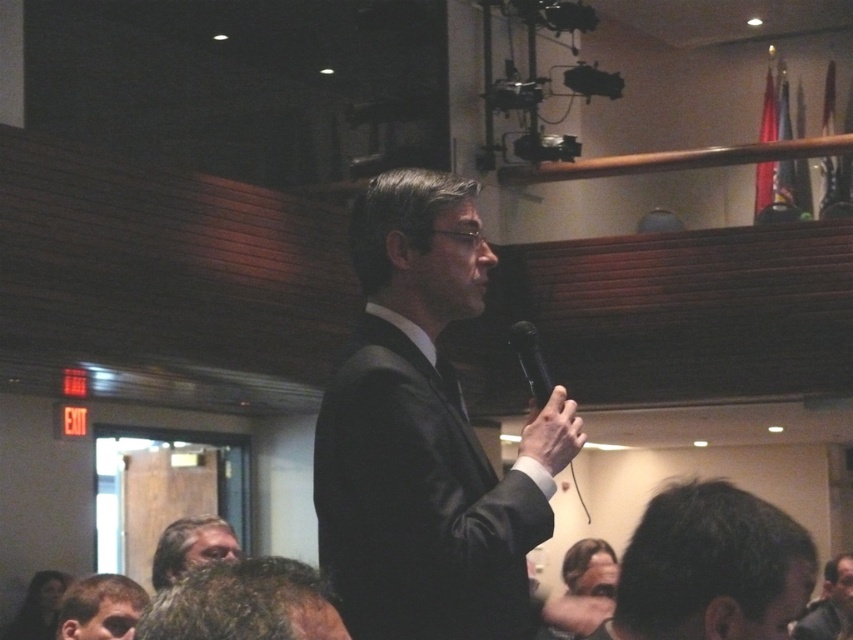
Question: Does smooth brown hair at lower center appear on the right side of dark suit at center?

Choices:
 (A) no
 (B) yes

Answer: (A)

Question: Which of these objects is positioned closest to the brown fuzzy hair at lower center?

Choices:
 (A) matte black suit at center
 (B) smooth brown hair at lower center

Answer: (A)

Question: Is matte black suit at center to the right of smooth skin hand at center from the viewer's perspective?

Choices:
 (A) yes
 (B) no

Answer: (B)

Question: Is matte black suit at center positioned in front of dark brown hair at lower left?

Choices:
 (A) yes
 (B) no

Answer: (A)

Question: Which of the following is the closest to the observer?

Choices:
 (A) (560, 458)
 (B) (517, 330)
 (C) (693, 540)
 (D) (187, 529)

Answer: (C)

Question: Which of the following is the closest to the observer?

Choices:
 (A) [704, 541]
 (B) [583, 436]

Answer: (A)